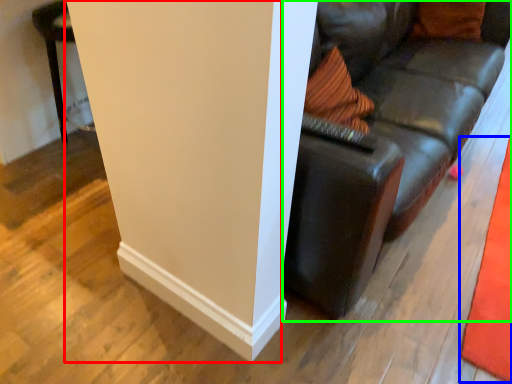
Question: Considering the real-world distances, which object is farthest from pillar (highlighted by a red box)? mat (highlighted by a blue box) or studio couch (highlighted by a green box)?

Choices:
 (A) mat
 (B) studio couch

Answer: (A)